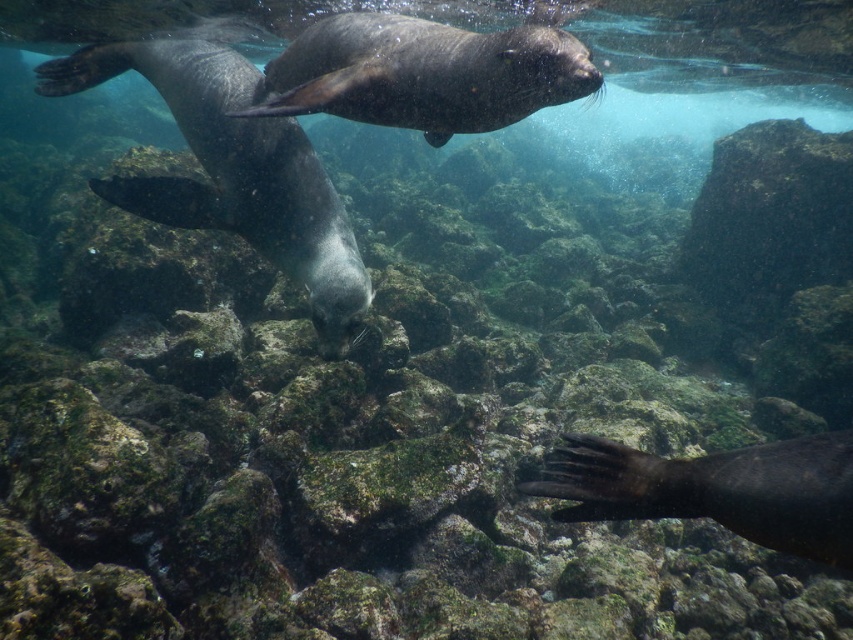
You are a marine biologist observing the underwater scene. You notice the green mossy rock at upper right and the dark gray fur seal at lower right. Based on their sizes, which one would cast a larger shadow on the seafloor?

The green mossy rock at upper right is much taller than the dark gray fur seal at lower right, so it would cast a larger shadow on the seafloor.

You are a marine biologist observing the underwater scene. You notice two seals in the image. Which seal has a greater width between the shiny gray seal at center and the shiny dark fur seal at upper center?

The shiny gray seal at center has a greater width than the shiny dark fur seal at upper center.